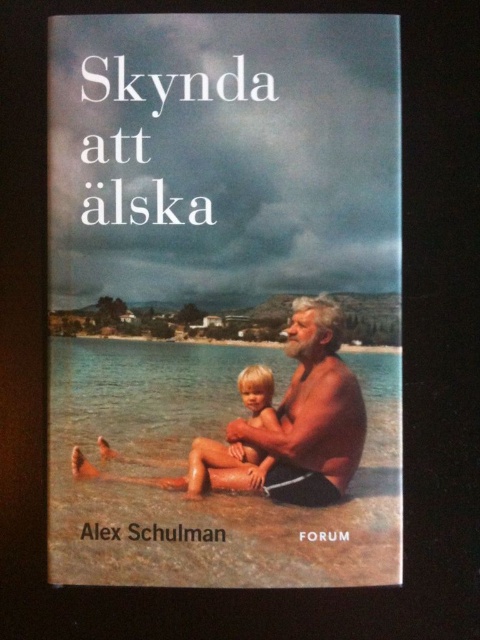
Question: Among these points, which one is farthest from the camera?

Choices:
 (A) (288, 525)
 (B) (86, 460)
 (C) (351, 387)
 (D) (276, 424)

Answer: (D)

Question: In this image, where is smooth skin man at center located relative to blonde hair skin at center?

Choices:
 (A) below
 (B) above

Answer: (B)

Question: In this image, where is smooth skin man at center located relative to blonde hair/soft skin child at center?

Choices:
 (A) above
 (B) below

Answer: (B)

Question: Which object is positioned farthest from the matte black book cover at center?

Choices:
 (A) smooth skin man at center
 (B) blonde hair/soft skin child at center
 (C) blonde hair skin at center

Answer: (B)

Question: Is matte black book cover at center closer to camera compared to blonde hair skin at center?

Choices:
 (A) no
 (B) yes

Answer: (B)

Question: Which point is closer to the camera taking this photo?

Choices:
 (A) (202, 472)
 (B) (266, 413)
 (C) (247, 486)

Answer: (C)